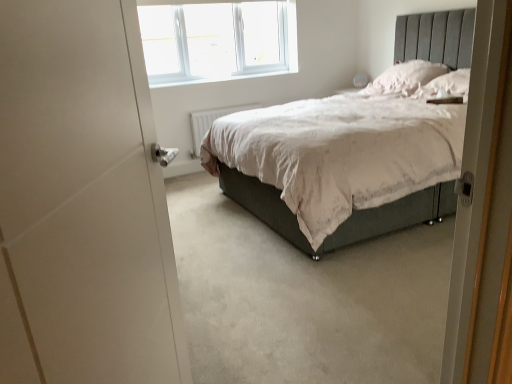
Question: Is white plastic radiator at center to the left or to the right of white plastic window at upper center in the image?

Choices:
 (A) left
 (B) right

Answer: (B)

Question: In terms of width, does white plastic radiator at center look wider or thinner when compared to white plastic window at upper center?

Choices:
 (A) thin
 (B) wide

Answer: (A)

Question: Estimate the real-world distances between objects in this image. Which object is farther from the white matte door at left?

Choices:
 (A) white plastic radiator at center
 (B) pink fabric pillow at upper right, which is counted as the second pillow, starting from the front
 (C) white plastic window at upper center
 (D) white soft pillow at upper right, marked as the 2th pillow in a back-to-front arrangement

Answer: (C)

Question: Based on their relative distances, which object is nearer to the white plastic window at upper center?

Choices:
 (A) white plastic radiator at center
 (B) white soft pillow at upper right, marked as the 2th pillow in a back-to-front arrangement
 (C) pink fabric pillow at upper right, which is counted as the second pillow, starting from the front
 (D) white matte door at left

Answer: (A)